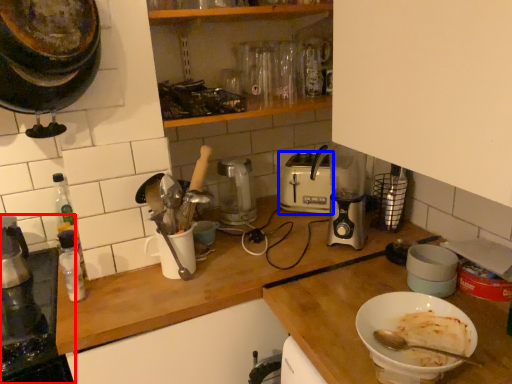
Question: Among these objects, which one is farthest to the camera, home appliance (highlighted by a red box) or toaster (highlighted by a blue box)?

Choices:
 (A) home appliance
 (B) toaster

Answer: (B)